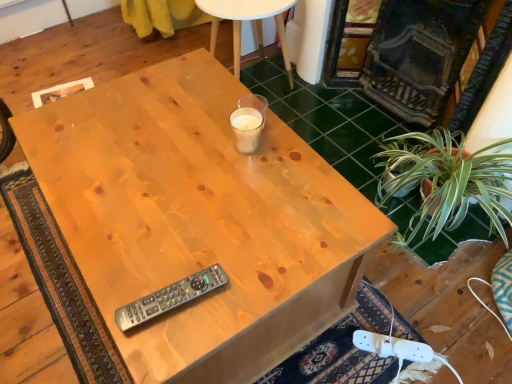
What are the coordinates of `vacant space behind translucent glass candle at center, marked as the first coffee cup in a bottom-to-top arrangement` in the screenshot? It's located at (221, 102).